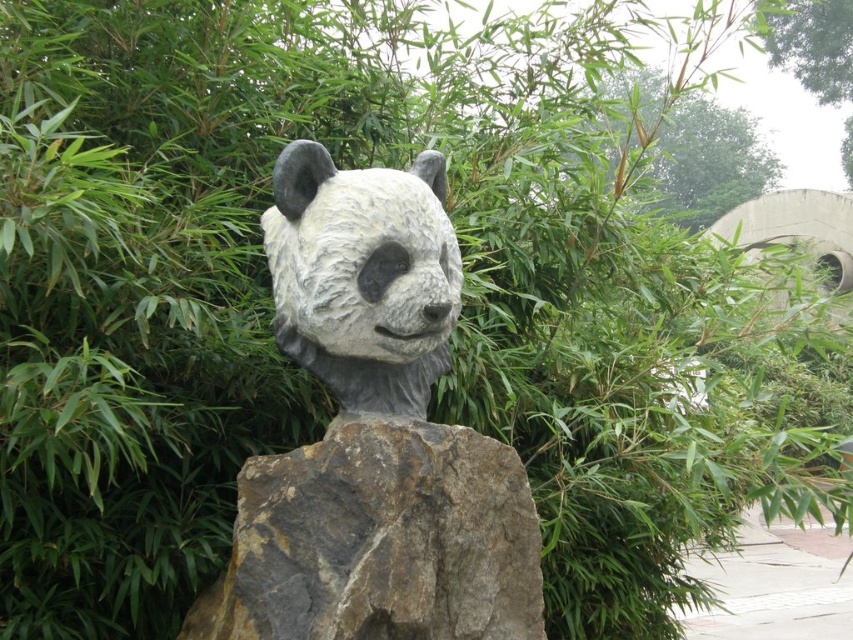
Where is `white stone panda head at center`? The image size is (853, 640). white stone panda head at center is located at coordinates (373, 435).

Which is above, white stone panda head at center or green leafy tree at upper right?

green leafy tree at upper right

Is point (328, 188) positioned before point (811, 90)?

Yes, point (328, 188) is in front of point (811, 90).

Find the location of a particular element. The image size is (853, 640). white stone panda head at center is located at coordinates (373, 435).

Can you confirm if white stone panda head at center is taller than gray stone statue at center?

Indeed, white stone panda head at center has a greater height compared to gray stone statue at center.

Can you confirm if white stone panda head at center is thinner than gray stone statue at center?

No, white stone panda head at center is not thinner than gray stone statue at center.

Where is `white stone panda head at center`? The height and width of the screenshot is (640, 853). white stone panda head at center is located at coordinates (373, 435).

Which is more to the left, gray rough rock at center or gray stone statue at center?

Positioned to the left is gray rough rock at center.

Between point (310, 451) and point (349, 288), which one is positioned in front?

Point (349, 288) is in front.

I want to click on gray rough rock at center, so click(x=379, y=540).

Where is `gray rough rock at center`? The width and height of the screenshot is (853, 640). gray rough rock at center is located at coordinates (379, 540).